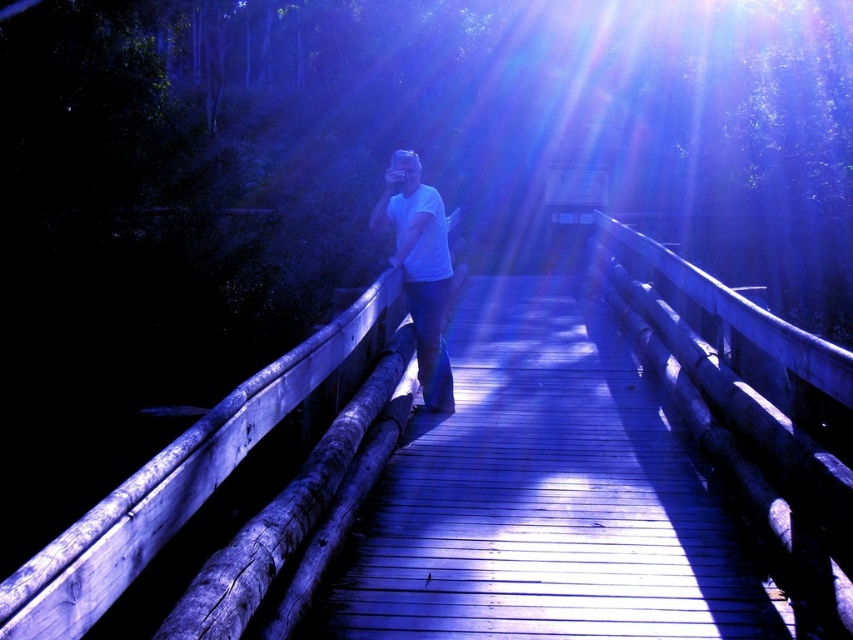
Measure the distance from wooden bridge at center to white matte shirt at center.

They are 3.62 feet apart.

Can you confirm if wooden bridge at center is shorter than white matte shirt at center?

Indeed, wooden bridge at center has a lesser height compared to white matte shirt at center.

Between point (677, 497) and point (396, 164), which one is positioned behind?

Positioned behind is point (396, 164).

This screenshot has height=640, width=853. Identify the location of wooden bridge at center. (544, 497).